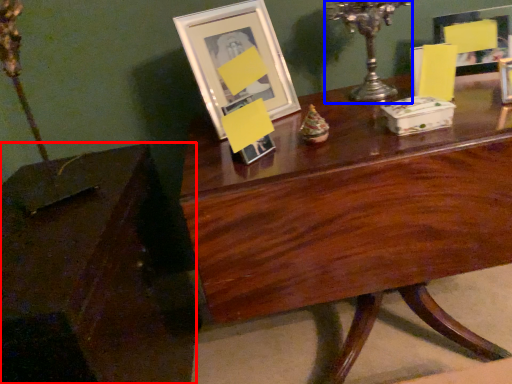
Question: Which point is closer to the camera, table (highlighted by a red box) or candle holder (highlighted by a blue box)?

Choices:
 (A) table
 (B) candle holder

Answer: (A)